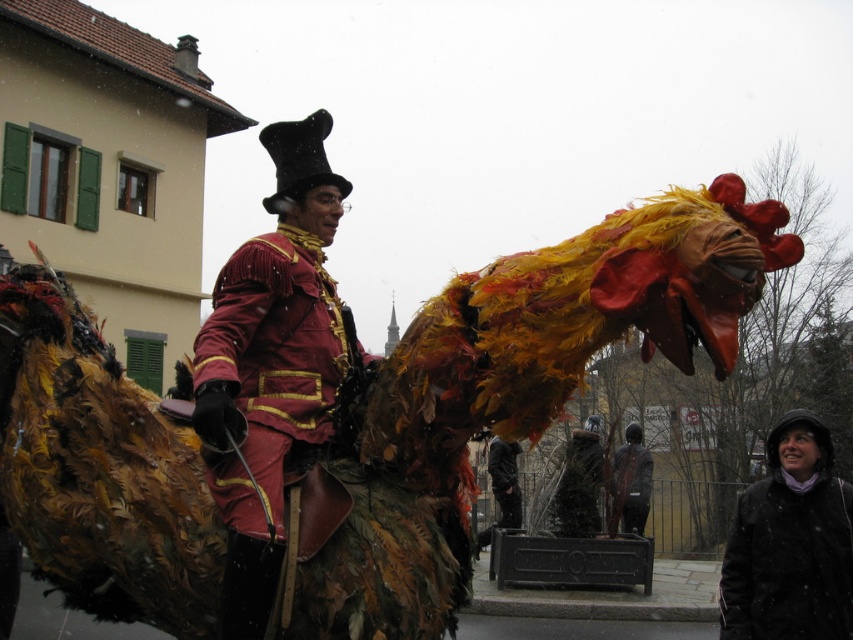
Question: In this image, where is shiny red coat at center located relative to black statue at center?

Choices:
 (A) right
 (B) left

Answer: (B)

Question: Which point is closer to the camera?

Choices:
 (A) (302, 288)
 (B) (845, 556)
 (C) (633, 486)

Answer: (A)

Question: Where is black woolen coat at lower right located in relation to black statue at center in the image?

Choices:
 (A) left
 (B) right

Answer: (A)

Question: Which point appears closest to the camera in this image?

Choices:
 (A) (634, 525)
 (B) (276, 300)

Answer: (B)

Question: Is black woolen coat at lower right to the left of black statue at center from the viewer's perspective?

Choices:
 (A) yes
 (B) no

Answer: (A)

Question: Which point is farther to the camera?

Choices:
 (A) black statue at center
 (B) black woolen coat at lower right

Answer: (A)